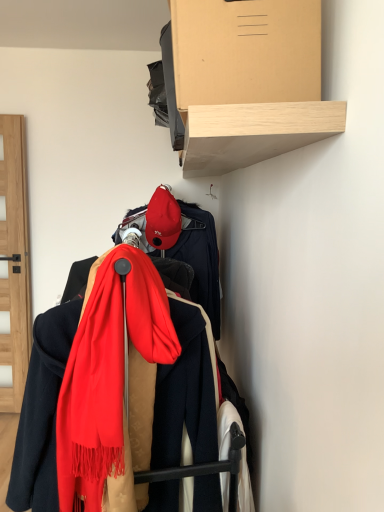
Question: Is matte red cap at center placed right next to light brown wooden shelf at upper center?

Choices:
 (A) no
 (B) yes

Answer: (A)

Question: Is matte red cap at center aimed at light brown wooden shelf at upper center?

Choices:
 (A) yes
 (B) no

Answer: (B)

Question: Can you confirm if matte red cap at center is positioned to the right of light brown wooden shelf at upper center?

Choices:
 (A) yes
 (B) no

Answer: (B)

Question: Is matte red cap at center bigger than light brown wooden shelf at upper center?

Choices:
 (A) yes
 (B) no

Answer: (B)

Question: Is matte red cap at center wider than light brown wooden shelf at upper center?

Choices:
 (A) yes
 (B) no

Answer: (B)

Question: From the image's perspective, is matte red cap at center beneath light brown wooden shelf at upper center?

Choices:
 (A) no
 (B) yes

Answer: (B)

Question: Does light brown wooden shelf at upper center appear on the left side of red soft scarf at center?

Choices:
 (A) yes
 (B) no

Answer: (B)

Question: Does light brown wooden shelf at upper center have a smaller size compared to red soft scarf at center?

Choices:
 (A) yes
 (B) no

Answer: (A)

Question: From the image's perspective, is light brown wooden shelf at upper center on red soft scarf at center?

Choices:
 (A) no
 (B) yes

Answer: (B)

Question: From a real-world perspective, does light brown wooden shelf at upper center sit lower than red soft scarf at center?

Choices:
 (A) yes
 (B) no

Answer: (B)

Question: Can you confirm if light brown wooden shelf at upper center is shorter than red soft scarf at center?

Choices:
 (A) no
 (B) yes

Answer: (B)

Question: Does light brown wooden shelf at upper center have a lesser width compared to red soft scarf at center?

Choices:
 (A) no
 (B) yes

Answer: (B)

Question: Does red soft scarf at center have a greater width compared to light brown wooden shelf at upper center?

Choices:
 (A) no
 (B) yes

Answer: (B)